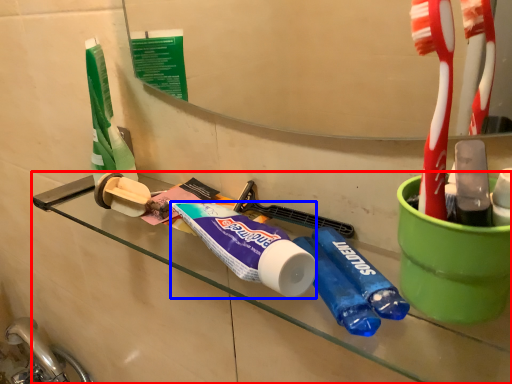
Question: Which of the following is the closest to the observer, counter (highlighted by a red box) or toothpaste (highlighted by a blue box)?

Choices:
 (A) counter
 (B) toothpaste

Answer: (A)